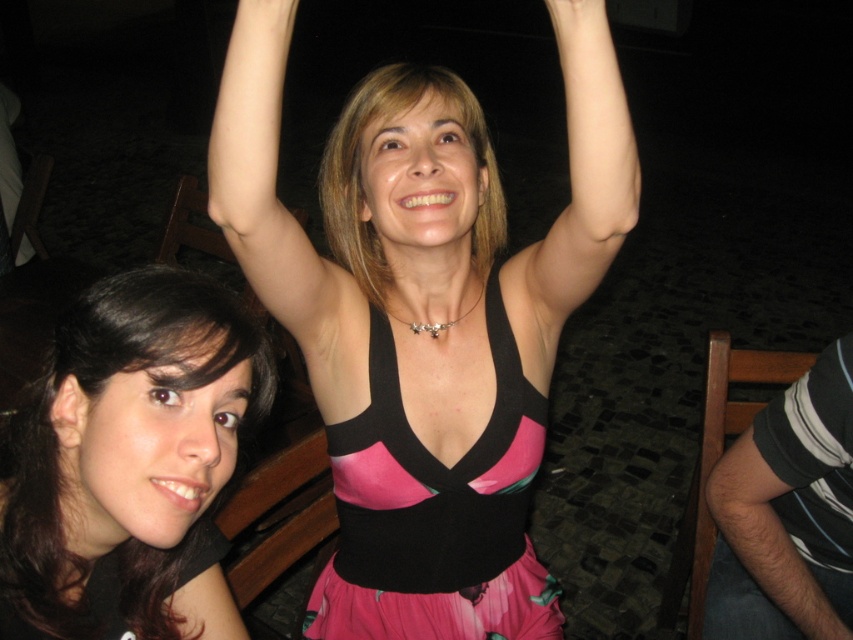
Question: Can you confirm if pink matte dress at center is positioned above pale skin at raised?

Choices:
 (A) no
 (B) yes

Answer: (A)

Question: Which of the following is the closest to the observer?

Choices:
 (A) matte black tank top at center
 (B) pale skin at raised

Answer: (B)

Question: Which object appears closest to the camera in this image?

Choices:
 (A) matte skin at upper center
 (B) pale skin at raised
 (C) matte black tank top at center

Answer: (A)

Question: Can you confirm if pink matte dress at center is thinner than matte skin at upper center?

Choices:
 (A) yes
 (B) no

Answer: (B)

Question: Does matte skin at upper center have a larger size compared to matte black tank top at center?

Choices:
 (A) no
 (B) yes

Answer: (A)

Question: Among these objects, which one is nearest to the camera?

Choices:
 (A) pink matte dress at center
 (B) matte black tank top at center

Answer: (A)